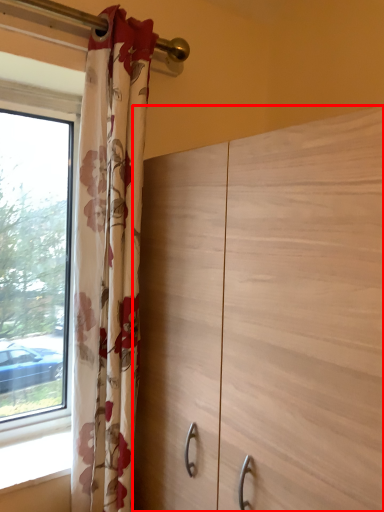
Question: In this image, where is dresser (annotated by the red box) located relative to curtain?

Choices:
 (A) right
 (B) left

Answer: (A)